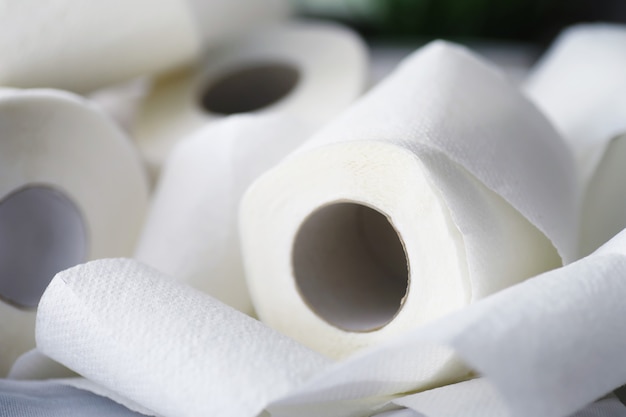
Find the location of a particular element. Image resolution: width=626 pixels, height=417 pixels. toilet paper rolls is located at coordinates (295, 190), (68, 167), (136, 112), (593, 65).